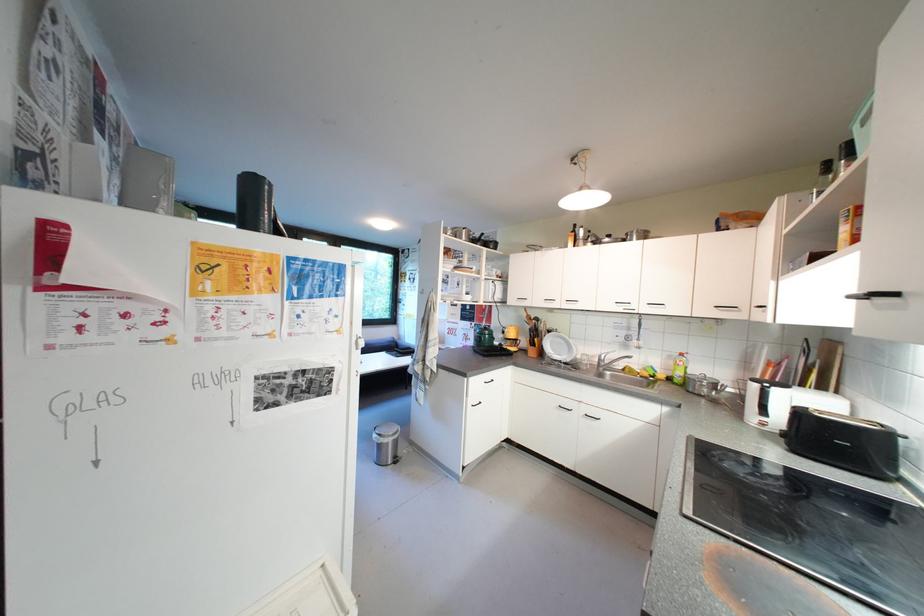
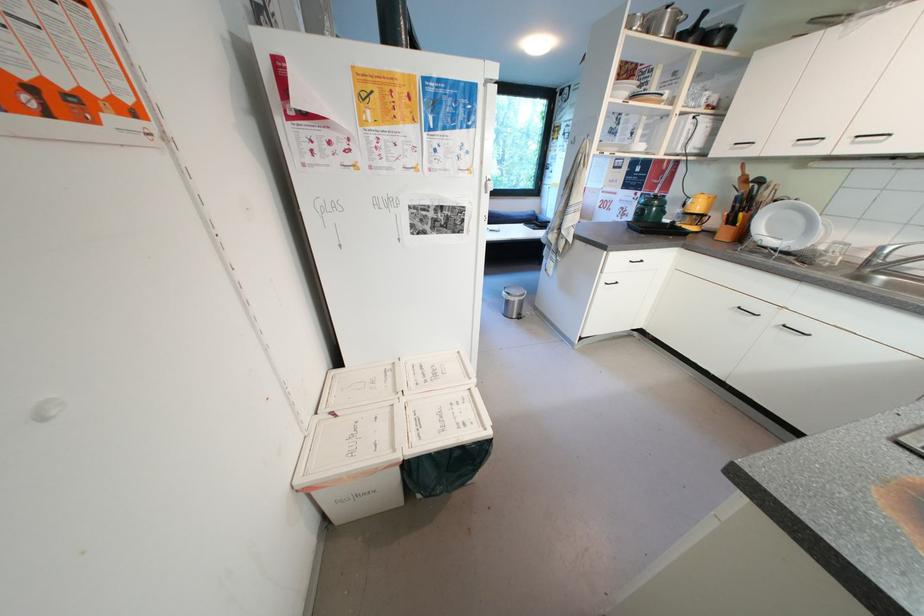
Find the pixel in the second image that matches point (592, 360) in the first image.

(845, 249)